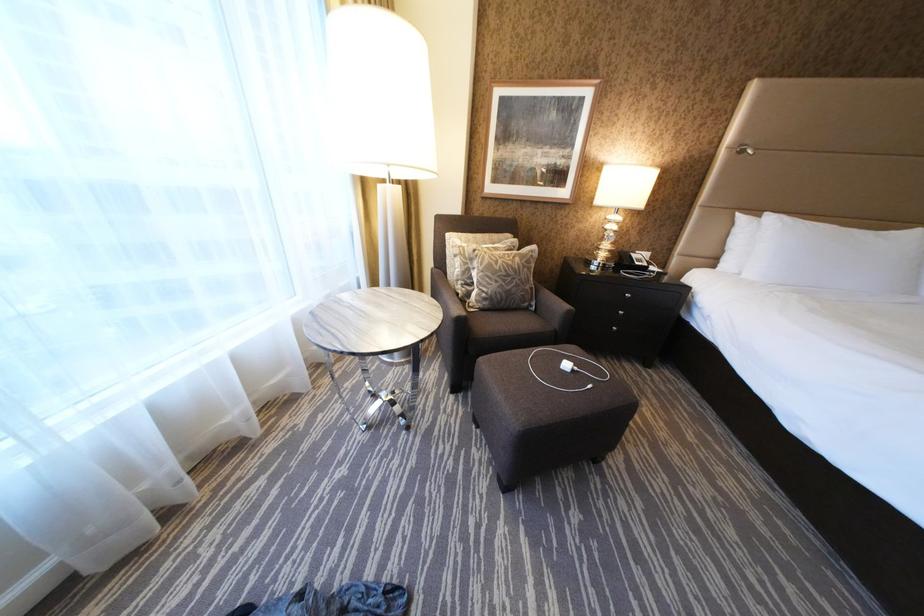
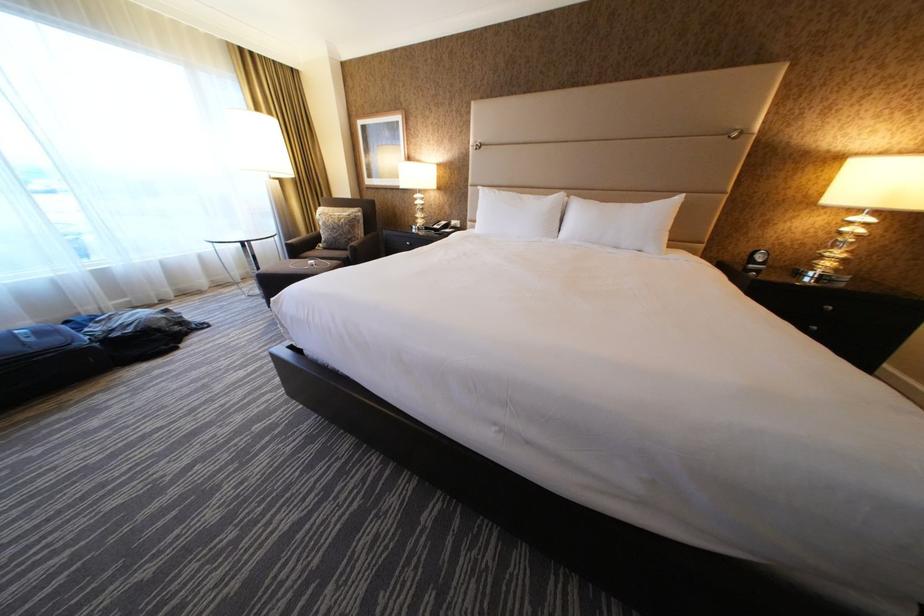
Question: In a continuous first-person perspective shot, in which direction is the camera moving?

Choices:
 (A) Left
 (B) Right
 (C) Forward
 (D) Backward

Answer: (B)